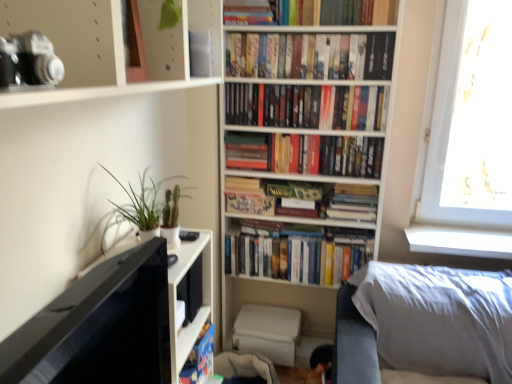
The height and width of the screenshot is (384, 512). I want to click on blank space situated above hardcover book at center, which is the 2th paperback book in left-to-right order (from a real-world perspective), so click(x=252, y=195).